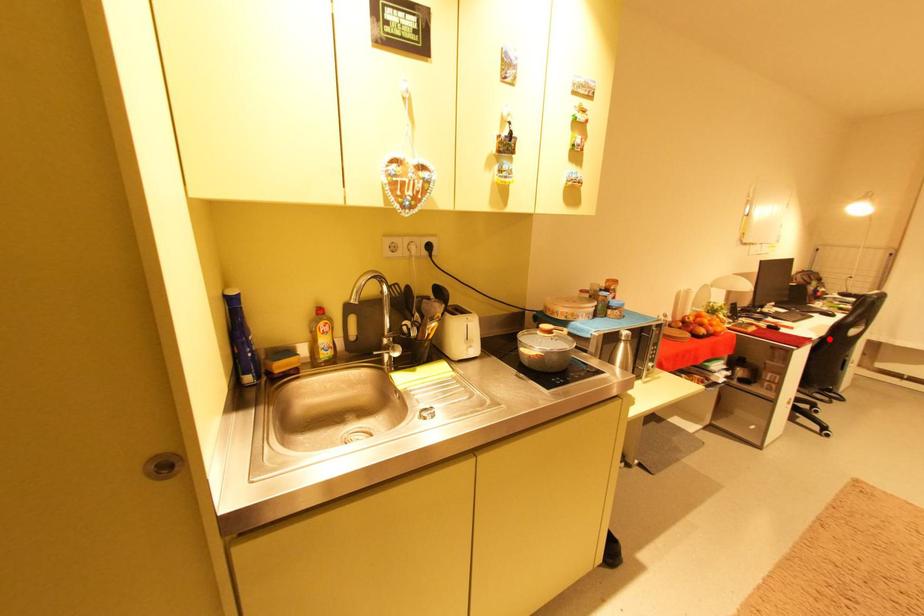
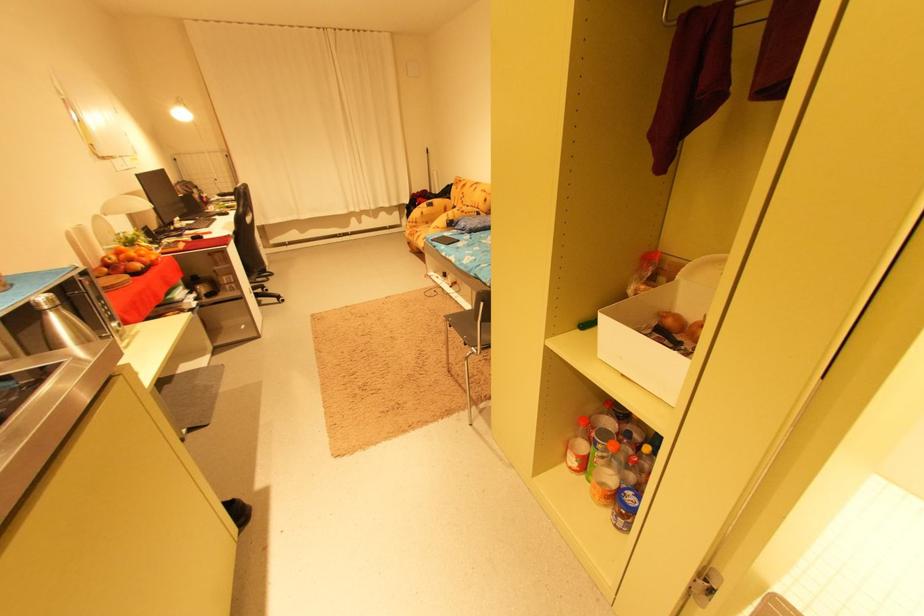
The point at the highlighted location is marked in the first image. Where is the corresponding point in the second image?

(242, 233)